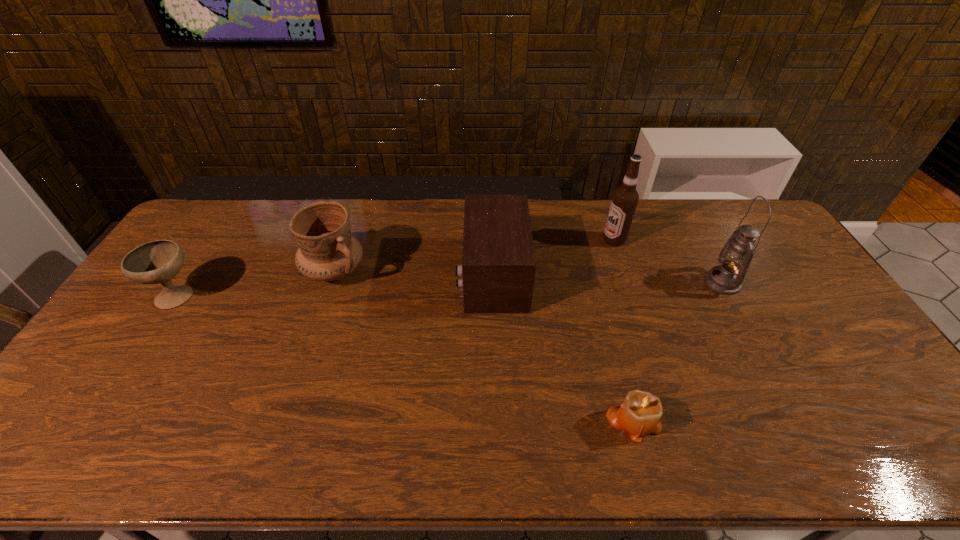
You are a GUI agent. You are given a task and a screenshot of the screen. Output one action in this format:
    pyautogui.click(x=<x>, y=<y>)
    Task: Click on the object positioned at the left edge
    
    Given the screenshot: What is the action you would take?
    pyautogui.click(x=155, y=262)

The height and width of the screenshot is (540, 960). In the image, there is a desktop. What are the coordinates of `vacant space at the far edge` in the screenshot? It's located at (352, 208).

The height and width of the screenshot is (540, 960). I want to click on free space at the near edge of the desktop, so click(x=770, y=454).

In order to click on free region at the right edge of the desktop in this screenshot , I will do `click(817, 329)`.

The height and width of the screenshot is (540, 960). I want to click on vacant area between the chalice and the rightmost object, so click(450, 289).

Image resolution: width=960 pixels, height=540 pixels. I want to click on empty space between the alcohol and the second shortest object, so click(x=396, y=268).

The height and width of the screenshot is (540, 960). What are the coordinates of `free space between the oil lamp and the fourth object from right to left` in the screenshot? It's located at (608, 279).

Locate an element on the screen. The width and height of the screenshot is (960, 540). vacant area that lies between the chalice and the shortest object is located at coordinates (405, 358).

Locate an element on the screen. free spot between the pottery and the shortest object is located at coordinates (484, 346).

The height and width of the screenshot is (540, 960). Find the location of `free spot between the pottery and the fifth tallest object`. free spot between the pottery and the fifth tallest object is located at coordinates pyautogui.click(x=256, y=284).